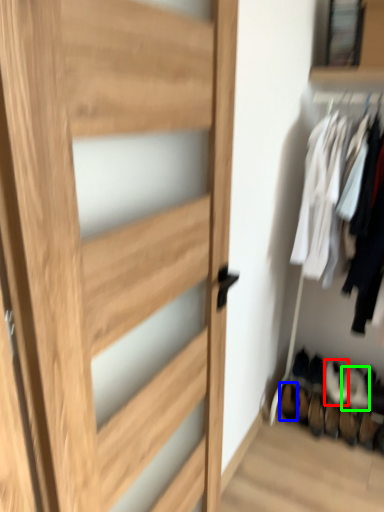
Question: Based on their relative distances, which object is nearer to shoe (highlighted by a red box)? Choose from shoe (highlighted by a blue box) and shoe (highlighted by a green box).

Choices:
 (A) shoe
 (B) shoe

Answer: (B)